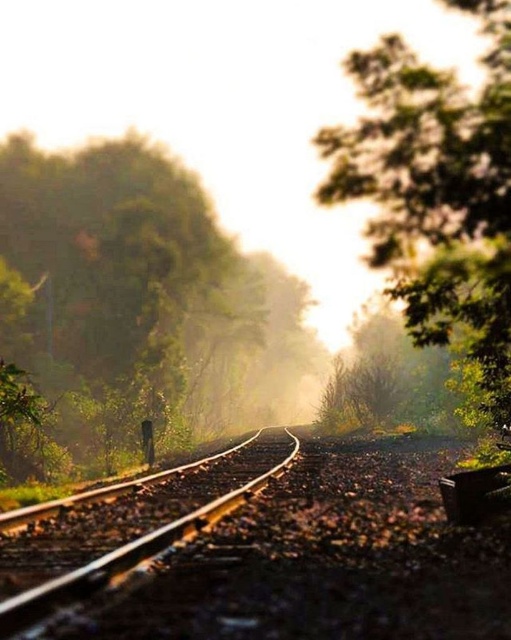
You are standing at the center of the railway tracks and want to walk towards the green leafy tree at left. In which direction should you head?

The green leafy tree at left is located at point 0.473 on the x and 0.217 on the y axis. To reach it from the center of the tracks, you should head towards the left side since it is positioned to the left of the tracks.

You are standing at the center of the railway tracks and looking towards the horizon. Which direction should you turn to see the green leafy tree at upper right?

You should turn to your right because the green leafy tree at upper right is located at point (x=436, y=193), which is to the upper right direction from your position at the center of the tracks.

You are a photographer aiming to capture the smooth metal train track at center and the green leafy tree at upper right in a single frame. Based on their sizes, which object will appear wider in the photo?

The green leafy tree at upper right will appear wider in the photo since its width is larger than the smooth metal train track at center.